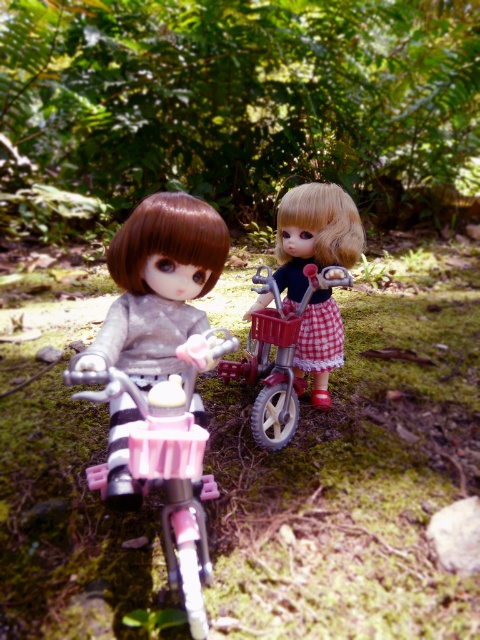
Question: Observing the image, what is the correct spatial positioning of pink plastic bicycle at left in reference to metallic silver bicycle at center?

Choices:
 (A) above
 (B) below

Answer: (B)

Question: Which point is farther to the camera?

Choices:
 (A) matte silver doll at left
 (B) pink plastic bicycle at left

Answer: (A)

Question: Which object is the farthest from the metallic silver bicycle at center?

Choices:
 (A) pink plastic bicycle at left
 (B) matte black doll at center

Answer: (A)

Question: In this image, where is pink plastic bicycle at left located relative to matte black doll at center?

Choices:
 (A) right
 (B) left

Answer: (B)

Question: Does pink plastic bicycle at left appear on the left side of matte black doll at center?

Choices:
 (A) yes
 (B) no

Answer: (A)

Question: Which object appears farthest from the camera in this image?

Choices:
 (A) matte black doll at center
 (B) metallic silver bicycle at center
 (C) pink plastic bicycle at left

Answer: (A)